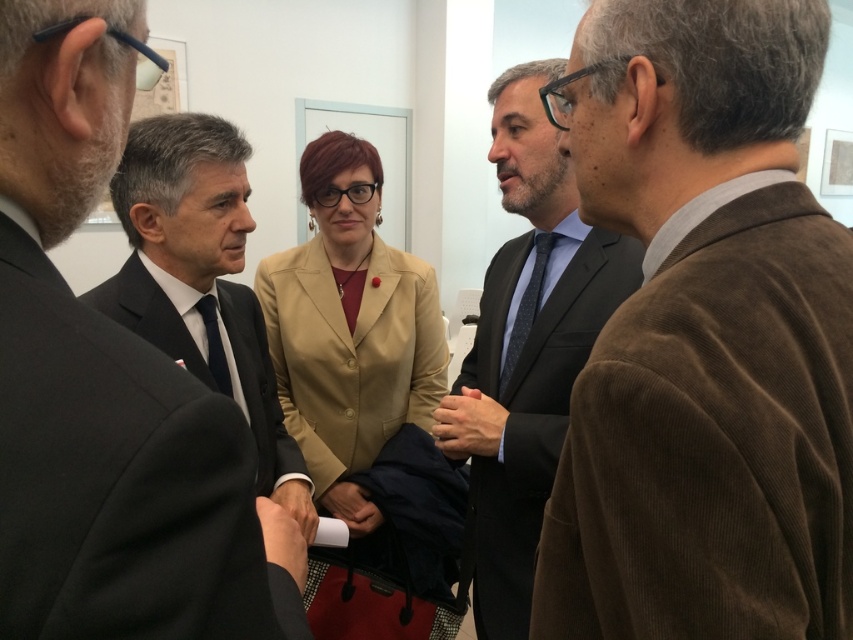
In the image, you see a brown corduroy jacket at right and a matte black handbag at center. Which object is positioned to the right of the other?

The brown corduroy jacket at right is to the right of the matte black handbag at center.

You are standing in front of the group and want to determine which of the two points, point (495,428) or point (312,513), is closer to you. Based on the scene description, which point is nearer?

Point (495,428) is further to the camera than point (312,513). Therefore, point (312,513) is closer to you.

Based on the scene description, where is the matte black suit at left positioned in the image?

The matte black suit at left is located at point 0.417 on the horizontal axis and 0.231 on the vertical axis.